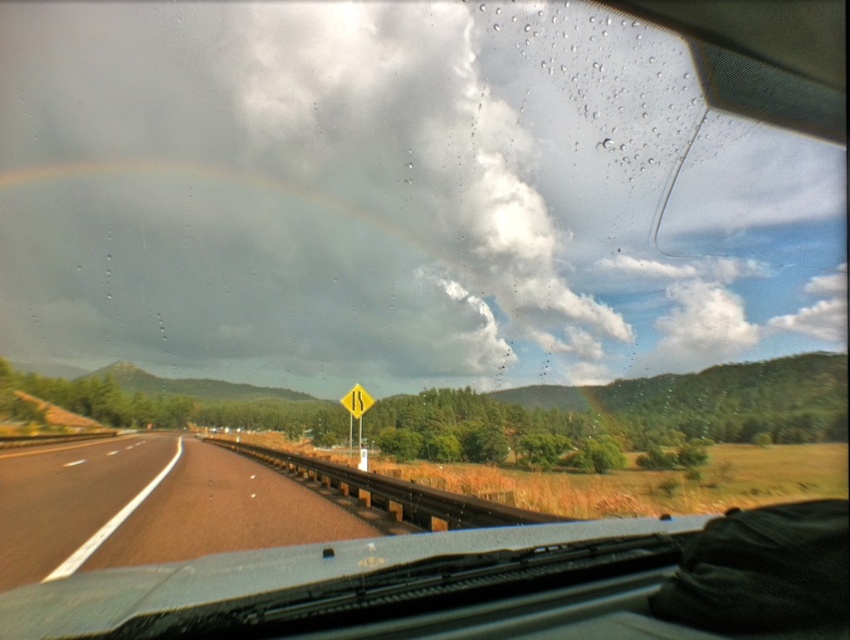
Question: Which point is farther from the camera taking this photo?

Choices:
 (A) (69, 508)
 (B) (354, 397)

Answer: (B)

Question: Is white fluffy cloud at upper center bigger than yellow reflective plastic at center?

Choices:
 (A) no
 (B) yes

Answer: (B)

Question: Which point is farther to the camera?

Choices:
 (A) brown asphalt highway at center
 (B) white fluffy cloud at upper center

Answer: (B)

Question: Is brown asphalt highway at center bigger than yellow reflective plastic at center?

Choices:
 (A) yes
 (B) no

Answer: (A)

Question: Is white fluffy cloud at upper center behind yellow reflective plastic at center?

Choices:
 (A) no
 (B) yes

Answer: (B)

Question: Which point appears farthest from the camera in this image?

Choices:
 (A) (214, 502)
 (B) (284, 132)
 (C) (363, 410)

Answer: (B)